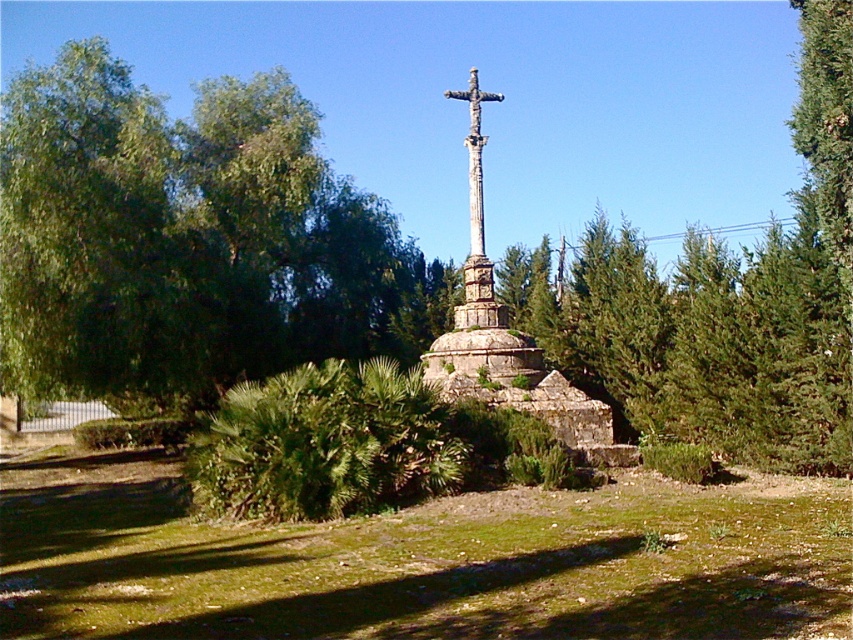
Question: Is green leafy tree at upper left positioned behind stone cross at center?

Choices:
 (A) no
 (B) yes

Answer: (B)

Question: Is stone cross at center thinner than stone textured cross at center?

Choices:
 (A) no
 (B) yes

Answer: (B)

Question: Which object is the farthest from the stone textured cross at center?

Choices:
 (A) green leafy tree at upper left
 (B) stone cross at center

Answer: (A)

Question: Among these objects, which one is farthest from the camera?

Choices:
 (A) stone textured cross at center
 (B) stone cross at center
 (C) green leafy tree at upper left

Answer: (C)

Question: Which of these objects is positioned closest to the stone cross at center?

Choices:
 (A) green leafy tree at upper left
 (B) stone textured cross at center

Answer: (B)

Question: Is green leafy tree at upper left to the left of stone cross at center from the viewer's perspective?

Choices:
 (A) no
 (B) yes

Answer: (B)